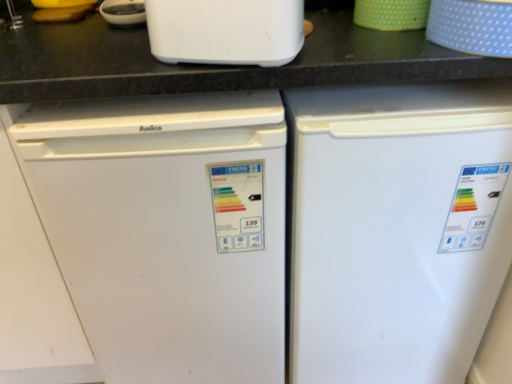
Locate an element on the screen. white matte refrigerator at left, the first refrigerator from the left is located at coordinates (166, 229).

Where is `blue dotted fabric at upper right, the first appliance viewed from the right`? blue dotted fabric at upper right, the first appliance viewed from the right is located at coordinates (472, 26).

Image resolution: width=512 pixels, height=384 pixels. Describe the element at coordinates (472, 26) in the screenshot. I see `blue dotted fabric at upper right, which ranks as the second appliance in left-to-right order` at that location.

How much space does white matte refrigerator at center, which appears as the second refrigerator when viewed from the left, occupy vertically?

white matte refrigerator at center, which appears as the second refrigerator when viewed from the left, is 36.60 inches in height.

This screenshot has width=512, height=384. Describe the element at coordinates (225, 31) in the screenshot. I see `white plastic toaster at upper center` at that location.

You are a GUI agent. You are given a task and a screenshot of the screen. Output one action in this format:
    pyautogui.click(x=<x>, y=<y>)
    Task: Click on the white plastic toaster at upper center
    
    Given the screenshot: What is the action you would take?
    pyautogui.click(x=225, y=31)

Describe the element at coordinates (391, 14) in the screenshot. I see `green dotted cup at upper right, which appears as the 1th appliance when viewed from the left` at that location.

Identify the location of white matte refrigerator at left, the first refrigerator from the left. (166, 229).

Identify the location of home appliance in front of the white matte refrigerator at center, which is the 1th refrigerator in right-to-left order. (225, 31).

Does white plastic toaster at upper center have a smaller size compared to white matte refrigerator at center, which is the 1th refrigerator in right-to-left order?

Correct, white plastic toaster at upper center occupies less space than white matte refrigerator at center, which is the 1th refrigerator in right-to-left order.

Can you see white plastic toaster at upper center touching white matte refrigerator at center, which is the 1th refrigerator in right-to-left order?

No, white plastic toaster at upper center is not next to white matte refrigerator at center, which is the 1th refrigerator in right-to-left order.

Visually, is white plastic toaster at upper center positioned to the left or to the right of white matte refrigerator at center, which is the 1th refrigerator in right-to-left order?

In the image, white plastic toaster at upper center appears on the left side of white matte refrigerator at center, which is the 1th refrigerator in right-to-left order.

Considering the sizes of objects green dotted cup at upper right, which appears as the 1th appliance when viewed from the left, and blue dotted fabric at upper right, the first appliance viewed from the right, in the image provided, who is smaller, green dotted cup at upper right, which appears as the 1th appliance when viewed from the left, or blue dotted fabric at upper right, the first appliance viewed from the right,?

green dotted cup at upper right, which appears as the 1th appliance when viewed from the left, is smaller.

Would you say green dotted cup at upper right, which appears as the 1th appliance when viewed from the left, is outside blue dotted fabric at upper right, which ranks as the second appliance in left-to-right order?

green dotted cup at upper right, which appears as the 1th appliance when viewed from the left, is positioned outside blue dotted fabric at upper right, which ranks as the second appliance in left-to-right order.

Can you tell me how much green dotted cup at upper right, which appears as the 1th appliance when viewed from the left, and blue dotted fabric at upper right, which ranks as the second appliance in left-to-right order, differ in facing direction?

There is a 0.000708-degree angle between the facing directions of green dotted cup at upper right, which appears as the 1th appliance when viewed from the left, and blue dotted fabric at upper right, which ranks as the second appliance in left-to-right order.

From a real-world perspective, is green dotted cup at upper right, the second appliance positioned from the right, positioned under blue dotted fabric at upper right, which ranks as the second appliance in left-to-right order, based on gravity?

Yes, from a real-world perspective, green dotted cup at upper right, the second appliance positioned from the right, is below blue dotted fabric at upper right, which ranks as the second appliance in left-to-right order.

Between white plastic toaster at upper center and green dotted cup at upper right, the second appliance positioned from the right, which one has larger size?

white plastic toaster at upper center.

Considering the relative sizes of white plastic toaster at upper center and green dotted cup at upper right, which appears as the 1th appliance when viewed from the left, in the image provided, is white plastic toaster at upper center wider than green dotted cup at upper right, which appears as the 1th appliance when viewed from the left,?

No.

Is white plastic toaster at upper center spatially inside green dotted cup at upper right, the second appliance positioned from the right, or outside of it?

white plastic toaster at upper center is not enclosed by green dotted cup at upper right, the second appliance positioned from the right.

In the scene shown: Would you consider blue dotted fabric at upper right, which ranks as the second appliance in left-to-right order, to be distant from white matte refrigerator at left, the second refrigerator when ordered from right to left?

No, blue dotted fabric at upper right, which ranks as the second appliance in left-to-right order, is in close proximity to white matte refrigerator at left, the second refrigerator when ordered from right to left.

From the image's perspective, is blue dotted fabric at upper right, which ranks as the second appliance in left-to-right order, located above or below white matte refrigerator at left, the second refrigerator when ordered from right to left?

Clearly, from the image's perspective, blue dotted fabric at upper right, which ranks as the second appliance in left-to-right order, is above white matte refrigerator at left, the second refrigerator when ordered from right to left.

Is blue dotted fabric at upper right, the first appliance viewed from the right, taller than white matte refrigerator at left, the first refrigerator from the left?

Incorrect, the height of blue dotted fabric at upper right, the first appliance viewed from the right, is not larger of that of white matte refrigerator at left, the first refrigerator from the left.

Choose the correct answer: Is green dotted cup at upper right, which appears as the 1th appliance when viewed from the left, inside white plastic toaster at upper center or outside it?

green dotted cup at upper right, which appears as the 1th appliance when viewed from the left, cannot be found inside white plastic toaster at upper center.

Can you tell me how much green dotted cup at upper right, which appears as the 1th appliance when viewed from the left, and white plastic toaster at upper center differ in facing direction?

11.2 degrees separate the facing orientations of green dotted cup at upper right, which appears as the 1th appliance when viewed from the left, and white plastic toaster at upper center.

Does green dotted cup at upper right, which appears as the 1th appliance when viewed from the left, have a greater width compared to white plastic toaster at upper center?

Correct, the width of green dotted cup at upper right, which appears as the 1th appliance when viewed from the left, exceeds that of white plastic toaster at upper center.

Considering the relative sizes of green dotted cup at upper right, which appears as the 1th appliance when viewed from the left, and white plastic toaster at upper center in the image provided, is green dotted cup at upper right, which appears as the 1th appliance when viewed from the left, shorter than white plastic toaster at upper center?

Indeed, green dotted cup at upper right, which appears as the 1th appliance when viewed from the left, has a lesser height compared to white plastic toaster at upper center.

Is white matte refrigerator at center, which is the 1th refrigerator in right-to-left order, far from green dotted cup at upper right, which appears as the 1th appliance when viewed from the left?

No, white matte refrigerator at center, which is the 1th refrigerator in right-to-left order, is not far from green dotted cup at upper right, which appears as the 1th appliance when viewed from the left.

Which is behind, white matte refrigerator at center, which appears as the second refrigerator when viewed from the left, or green dotted cup at upper right, the second appliance positioned from the right?

green dotted cup at upper right, the second appliance positioned from the right, is further away from the camera.

Which is more to the right, white matte refrigerator at center, which appears as the second refrigerator when viewed from the left, or green dotted cup at upper right, the second appliance positioned from the right?

white matte refrigerator at center, which appears as the second refrigerator when viewed from the left.

Measure the distance between white matte refrigerator at center, which is the 1th refrigerator in right-to-left order, and green dotted cup at upper right, which appears as the 1th appliance when viewed from the left.

A distance of 17.34 inches exists between white matte refrigerator at center, which is the 1th refrigerator in right-to-left order, and green dotted cup at upper right, which appears as the 1th appliance when viewed from the left.

Which object is positioned more to the right, white matte refrigerator at center, which is the 1th refrigerator in right-to-left order, or white matte refrigerator at left, the second refrigerator when ordered from right to left?

Positioned to the right is white matte refrigerator at center, which is the 1th refrigerator in right-to-left order.

Is white matte refrigerator at left, the first refrigerator from the left, inside white matte refrigerator at center, which is the 1th refrigerator in right-to-left order?

No.

From a real-world perspective, is white matte refrigerator at center, which is the 1th refrigerator in right-to-left order, physically above white matte refrigerator at left, the second refrigerator when ordered from right to left?

Actually, white matte refrigerator at center, which is the 1th refrigerator in right-to-left order, is physically below white matte refrigerator at left, the second refrigerator when ordered from right to left, in the real world.

At what (x,y) coordinates should I click in order to perform the action: click on refrigerator to the right of white plastic toaster at upper center. Please return your answer as a coordinate pair (x, y). This screenshot has height=384, width=512. Looking at the image, I should click on (396, 228).

Find the location of a particular element. The height and width of the screenshot is (384, 512). appliance directly beneath the blue dotted fabric at upper right, which ranks as the second appliance in left-to-right order (from a real-world perspective) is located at coordinates (391, 14).

Considering their positions, is white matte refrigerator at left, the first refrigerator from the left, positioned closer to green dotted cup at upper right, the second appliance positioned from the right, than blue dotted fabric at upper right, which ranks as the second appliance in left-to-right order?

Based on the image, blue dotted fabric at upper right, which ranks as the second appliance in left-to-right order, appears to be nearer to green dotted cup at upper right, the second appliance positioned from the right.

In the scene shown: Considering their positions, is white matte refrigerator at center, which is the 1th refrigerator in right-to-left order, positioned closer to white matte refrigerator at left, the second refrigerator when ordered from right to left, than white plastic toaster at upper center?

white matte refrigerator at center, which is the 1th refrigerator in right-to-left order, is closer to white matte refrigerator at left, the second refrigerator when ordered from right to left.

When comparing their distances from white matte refrigerator at left, the second refrigerator when ordered from right to left, does green dotted cup at upper right, the second appliance positioned from the right, or white matte refrigerator at center, which appears as the second refrigerator when viewed from the left, seem further?

Based on the image, green dotted cup at upper right, the second appliance positioned from the right, appears to be further to white matte refrigerator at left, the second refrigerator when ordered from right to left.

Looking at the image, which one is located further to white plastic toaster at upper center, blue dotted fabric at upper right, which ranks as the second appliance in left-to-right order, or white matte refrigerator at center, which appears as the second refrigerator when viewed from the left?

Based on the image, white matte refrigerator at center, which appears as the second refrigerator when viewed from the left, appears to be further to white plastic toaster at upper center.

Estimate the real-world distances between objects in this image. Which object is closer to white matte refrigerator at center, which appears as the second refrigerator when viewed from the left, white matte refrigerator at left, the second refrigerator when ordered from right to left, or blue dotted fabric at upper right, the first appliance viewed from the right?

white matte refrigerator at left, the second refrigerator when ordered from right to left, is positioned closer to the anchor white matte refrigerator at center, which appears as the second refrigerator when viewed from the left.

Based on their spatial positions, is blue dotted fabric at upper right, the first appliance viewed from the right, or white plastic toaster at upper center further from white matte refrigerator at left, the first refrigerator from the left?

blue dotted fabric at upper right, the first appliance viewed from the right.

Consider the image. When comparing their distances from blue dotted fabric at upper right, which ranks as the second appliance in left-to-right order, does green dotted cup at upper right, which appears as the 1th appliance when viewed from the left, or white matte refrigerator at center, which appears as the second refrigerator when viewed from the left, seem further?

Based on the image, white matte refrigerator at center, which appears as the second refrigerator when viewed from the left, appears to be further to blue dotted fabric at upper right, which ranks as the second appliance in left-to-right order.

From the image, which object appears to be nearer to white plastic toaster at upper center, blue dotted fabric at upper right, which ranks as the second appliance in left-to-right order, or white matte refrigerator at left, the first refrigerator from the left?

white matte refrigerator at left, the first refrigerator from the left, lies closer to white plastic toaster at upper center than the other object.

Where is `home appliance between white matte refrigerator at left, the second refrigerator when ordered from right to left, and green dotted cup at upper right, which appears as the 1th appliance when viewed from the left, in the horizontal direction`? This screenshot has width=512, height=384. home appliance between white matte refrigerator at left, the second refrigerator when ordered from right to left, and green dotted cup at upper right, which appears as the 1th appliance when viewed from the left, in the horizontal direction is located at coordinates (225, 31).

In order to click on appliance between green dotted cup at upper right, which appears as the 1th appliance when viewed from the left, and white matte refrigerator at center, which appears as the second refrigerator when viewed from the left, from top to bottom in this screenshot , I will do `click(472, 26)`.

What are the coordinates of `appliance between white matte refrigerator at left, the first refrigerator from the left, and blue dotted fabric at upper right, which ranks as the second appliance in left-to-right order` in the screenshot? It's located at [x=391, y=14].

Find the location of a particular element. Image resolution: width=512 pixels, height=384 pixels. refrigerator between white plastic toaster at upper center and blue dotted fabric at upper right, which ranks as the second appliance in left-to-right order is located at coordinates (396, 228).